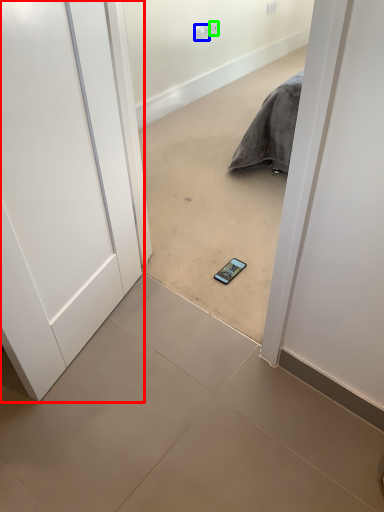
Question: Based on their relative distances, which object is farther from door (highlighted by a red box)? Choose from electric outlet (highlighted by a blue box) and electric outlet (highlighted by a green box).

Choices:
 (A) electric outlet
 (B) electric outlet

Answer: (B)